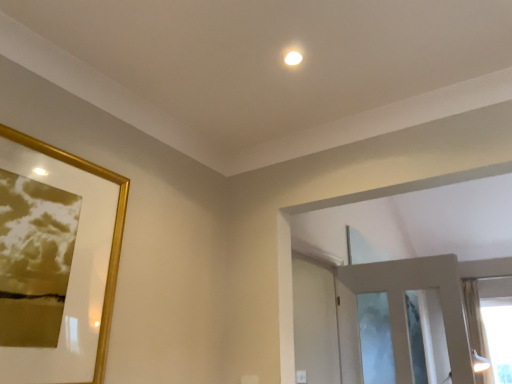
Locate an element on the screen. The height and width of the screenshot is (384, 512). white glossy screen door at center is located at coordinates (315, 321).

Where is `sheer fabric curtain at right`? This screenshot has height=384, width=512. sheer fabric curtain at right is located at coordinates (474, 317).

Is white glossy screen door at center not close to gold glossy picture frame at upper left?

Yes, white glossy screen door at center is far from gold glossy picture frame at upper left.

Considering the positions of point (332, 347) and point (108, 310), is point (332, 347) closer or farther from the camera than point (108, 310)?

Point (332, 347) is farther from the camera than point (108, 310).

From the image's perspective, is white glossy screen door at center below gold glossy picture frame at upper left?

Yes, from the image's perspective, white glossy screen door at center is below gold glossy picture frame at upper left.

From a real-world perspective, which object stands above the other?

In real-world perspective, sheer fabric curtain at right is above.

Is point (474, 294) closer or farther from the camera than point (31, 144)?

Clearly, point (474, 294) is more distant from the camera than point (31, 144).

Considering the positions of objects sheer fabric curtain at right and gold glossy picture frame at upper left in the image provided, who is more to the left, sheer fabric curtain at right or gold glossy picture frame at upper left?

gold glossy picture frame at upper left.

Locate an element on the screen. The image size is (512, 384). picture frame above the sheer fabric curtain at right (from the image's perspective) is located at coordinates (112, 236).

Is gold glossy picture frame at upper left not close to white glossy screen door at center?

Yes, gold glossy picture frame at upper left is far from white glossy screen door at center.

Which object is closer to the camera, gold glossy picture frame at upper left or white glossy screen door at center?

gold glossy picture frame at upper left is more forward.

Is gold glossy picture frame at upper left looking in the opposite direction of white glossy screen door at center?

That's not correct — gold glossy picture frame at upper left is not looking away from white glossy screen door at center.

Which object is wider, gold glossy picture frame at upper left or white glossy screen door at center?

With larger width is white glossy screen door at center.

Is sheer fabric curtain at right next to white glossy screen door at center and touching it?

There is a gap between sheer fabric curtain at right and white glossy screen door at center.

Is sheer fabric curtain at right inside the boundaries of white glossy screen door at center, or outside?

sheer fabric curtain at right is spatially situated outside white glossy screen door at center.

Find the location of a particular element. The image size is (512, 384). window above the white glossy screen door at center (from a real-world perspective) is located at coordinates (474, 317).

Between white glossy screen door at center and sheer fabric curtain at right, which one appears on the right side from the viewer's perspective?

From the viewer's perspective, sheer fabric curtain at right appears more on the right side.

Considering the relative sizes of white glossy screen door at center and sheer fabric curtain at right in the image provided, is white glossy screen door at center taller than sheer fabric curtain at right?

In fact, white glossy screen door at center may be shorter than sheer fabric curtain at right.

The image size is (512, 384). What are the coordinates of `screen door above the sheer fabric curtain at right (from the image's perspective)` in the screenshot? It's located at (315, 321).

From a real-world perspective, does white glossy screen door at center sit lower than sheer fabric curtain at right?

Indeed, from a real-world perspective, white glossy screen door at center is positioned beneath sheer fabric curtain at right.

Would you say sheer fabric curtain at right is part of gold glossy picture frame at upper left's contents?

No, sheer fabric curtain at right is not inside gold glossy picture frame at upper left.

From the image's perspective, which is below, gold glossy picture frame at upper left or sheer fabric curtain at right?

sheer fabric curtain at right, from the image's perspective.

Is gold glossy picture frame at upper left with sheer fabric curtain at right?

There is a gap between gold glossy picture frame at upper left and sheer fabric curtain at right.

Which is farther, (99, 373) or (481, 337)?

Point (481, 337)

There is a white glossy screen door at center. Where is `picture frame above it (from a real-world perspective)`? This screenshot has height=384, width=512. picture frame above it (from a real-world perspective) is located at coordinates (112, 236).

Locate an element on the screen. window on the right of gold glossy picture frame at upper left is located at coordinates (474, 317).

Looking at this image, when comparing their distances from white glossy screen door at center, does sheer fabric curtain at right or gold glossy picture frame at upper left seem further?

sheer fabric curtain at right is positioned further to the anchor white glossy screen door at center.

Based on their spatial positions, is white glossy screen door at center or sheer fabric curtain at right closer to gold glossy picture frame at upper left?

The object closer to gold glossy picture frame at upper left is white glossy screen door at center.

Which object lies further to the anchor point sheer fabric curtain at right, white glossy screen door at center or gold glossy picture frame at upper left?

The object further to sheer fabric curtain at right is gold glossy picture frame at upper left.

Looking at the image, which one is located further to white glossy screen door at center, gold glossy picture frame at upper left or sheer fabric curtain at right?

The object further to white glossy screen door at center is sheer fabric curtain at right.

Estimate the real-world distances between objects in this image. Which object is further from gold glossy picture frame at upper left, sheer fabric curtain at right or white glossy screen door at center?

The object further to gold glossy picture frame at upper left is sheer fabric curtain at right.

When comparing their distances from sheer fabric curtain at right, does gold glossy picture frame at upper left or white glossy screen door at center seem further?

The object further to sheer fabric curtain at right is gold glossy picture frame at upper left.

Identify the location of screen door located between gold glossy picture frame at upper left and sheer fabric curtain at right in the depth direction. (315, 321).